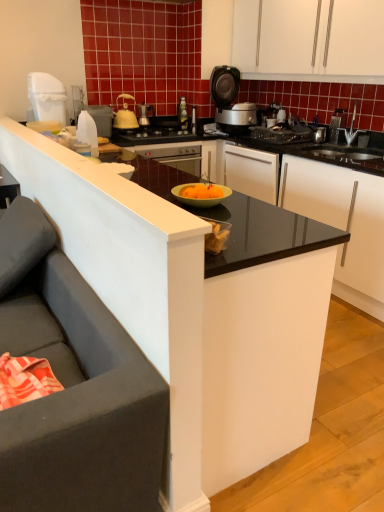
Image resolution: width=384 pixels, height=512 pixels. What do you see at coordinates (87, 132) in the screenshot?
I see `white plastic bottle at left, the first kitchen appliance from the front` at bounding box center [87, 132].

Describe the element at coordinates (47, 97) in the screenshot. The height and width of the screenshot is (512, 384). I see `white plastic trash can at upper left, acting as the 2th kitchen appliance starting from the front` at that location.

Find the location of a particular element. The image size is (384, 512). yellow matte kettle at upper center, the 3th kitchen appliance when ordered from left to right is located at coordinates (125, 114).

This screenshot has width=384, height=512. Describe the element at coordinates (310, 40) in the screenshot. I see `white matte cabinet at upper center` at that location.

The width and height of the screenshot is (384, 512). What do you see at coordinates (189, 315) in the screenshot?
I see `black glossy countertop at center` at bounding box center [189, 315].

Where is `black glossy countertop at center`? black glossy countertop at center is located at coordinates (189, 315).

Find the location of a particular element. Image resolution: width=384 pixels, height=512 pixels. white plastic bottle at left, which is the fourth kitchen appliance from back to front is located at coordinates (87, 132).

In the image, is metallic silver coffee maker at upper center, which is the 4th kitchen appliance in front-to-back order, positioned in front of or behind white plastic bottle at left, which is the fourth kitchen appliance from back to front?

Clearly, metallic silver coffee maker at upper center, which is the 4th kitchen appliance in front-to-back order, is behind white plastic bottle at left, which is the fourth kitchen appliance from back to front.

How different are the orientations of metallic silver coffee maker at upper center, acting as the 4th kitchen appliance starting from the left, and white plastic bottle at left, arranged as the 2th kitchen appliance when viewed from the left, in degrees?

The angle between the facing direction of metallic silver coffee maker at upper center, acting as the 4th kitchen appliance starting from the left, and the facing direction of white plastic bottle at left, arranged as the 2th kitchen appliance when viewed from the left, is 87.8 degrees.

Is metallic silver coffee maker at upper center, marked as the 1th kitchen appliance in a back-to-front arrangement, turned away from white plastic bottle at left, the first kitchen appliance from the front?

No, metallic silver coffee maker at upper center, marked as the 1th kitchen appliance in a back-to-front arrangement,'s orientation is not away from white plastic bottle at left, the first kitchen appliance from the front.

From the image's perspective, is metallic silver coffee maker at upper center, marked as the 1th kitchen appliance in a right-to-left arrangement, located above or below white plastic bottle at left, the first kitchen appliance from the front?

From the image's perspective, metallic silver coffee maker at upper center, marked as the 1th kitchen appliance in a right-to-left arrangement, appears above white plastic bottle at left, the first kitchen appliance from the front.

Is white plastic bottle at left, marked as the 3th kitchen appliance in a right-to-left arrangement, positioned behind yellow matte kettle at upper center, the 3th kitchen appliance when ordered from left to right?

No, white plastic bottle at left, marked as the 3th kitchen appliance in a right-to-left arrangement, is closer to the viewer.

Is white plastic bottle at left, which is the fourth kitchen appliance from back to front, to the left of yellow matte kettle at upper center, the 3th kitchen appliance when ordered from left to right, from the viewer's perspective?

Correct, you'll find white plastic bottle at left, which is the fourth kitchen appliance from back to front, to the left of yellow matte kettle at upper center, the 3th kitchen appliance when ordered from left to right.

Between white plastic bottle at left, which is the fourth kitchen appliance from back to front, and yellow matte kettle at upper center, the 3th kitchen appliance when ordered from left to right, which one has less height?

With less height is yellow matte kettle at upper center, the 3th kitchen appliance when ordered from left to right.

Is white plastic bottle at left, which is the fourth kitchen appliance from back to front, next to yellow matte kettle at upper center, which ranks as the 2th kitchen appliance in right-to-left order?

There is a gap between white plastic bottle at left, which is the fourth kitchen appliance from back to front, and yellow matte kettle at upper center, which ranks as the 2th kitchen appliance in right-to-left order.

Who is taller, black glossy countertop at center or yellow matte gas stove at center?

With more height is black glossy countertop at center.

Looking at the image, does black glossy countertop at center seem bigger or smaller compared to yellow matte gas stove at center?

Clearly, black glossy countertop at center is larger in size than yellow matte gas stove at center.

How far apart are black glossy countertop at center and yellow matte gas stove at center?

5.62 feet.

From the picture: Is black glossy countertop at center thinner than yellow matte gas stove at center?

In fact, black glossy countertop at center might be wider than yellow matte gas stove at center.

Is yellow matte gas stove at center inside white matte cabinet at upper center?

Actually, yellow matte gas stove at center is outside white matte cabinet at upper center.

Is point (288, 36) positioned after point (185, 134)?

No.

Who is taller, white matte cabinet at upper center or yellow matte gas stove at center?

white matte cabinet at upper center.

Considering the points (140, 110) and (224, 108), which point is in front, point (140, 110) or point (224, 108)?

The point (140, 110) is in front.

Does metallic silver coffee maker at upper center, marked as the 1th kitchen appliance in a back-to-front arrangement, have a lesser width compared to matte black rice cooker at upper center?

Yes, metallic silver coffee maker at upper center, marked as the 1th kitchen appliance in a back-to-front arrangement, is thinner than matte black rice cooker at upper center.

Looking at the image, does metallic silver coffee maker at upper center, which is the 4th kitchen appliance in front-to-back order, seem bigger or smaller compared to matte black rice cooker at upper center?

metallic silver coffee maker at upper center, which is the 4th kitchen appliance in front-to-back order, is smaller than matte black rice cooker at upper center.

Looking at this image, can you confirm if white plastic bottle at left, the first kitchen appliance from the front, is shorter than white matte cabinet at upper center?

Correct, white plastic bottle at left, the first kitchen appliance from the front, is not as tall as white matte cabinet at upper center.

Which kitchen appliance is the 3rd one when counting from the left side of the white matte cabinet at upper center? Please provide its 2D coordinates.

[(87, 132)]

From the image's perspective, between white plastic bottle at left, marked as the 3th kitchen appliance in a right-to-left arrangement, and white matte cabinet at upper center, which one is located above?

white matte cabinet at upper center.

In the image, is white plastic bottle at left, arranged as the 2th kitchen appliance when viewed from the left, positioned in front of or behind white matte cabinet at upper center?

white plastic bottle at left, arranged as the 2th kitchen appliance when viewed from the left, is behind white matte cabinet at upper center.

Is black glossy countertop at center to the left of dark gray fabric studio couch at left from the viewer's perspective?

No.

Does black glossy countertop at center have a lesser width compared to dark gray fabric studio couch at left?

Incorrect, the width of black glossy countertop at center is not less than that of dark gray fabric studio couch at left.

Which is closer to the camera, (85, 251) or (114, 463)?

Point (114, 463)

Considering the relative sizes of black glossy countertop at center and dark gray fabric studio couch at left in the image provided, is black glossy countertop at center shorter than dark gray fabric studio couch at left?

No, black glossy countertop at center is not shorter than dark gray fabric studio couch at left.

From the white plastic bottle at left, arranged as the 2th kitchen appliance when viewed from the left, count 3rd kitchen appliances backward and point to it. Please provide its 2D coordinates.

[(144, 114)]

Find the location of a particular element. The image size is (384, 512). kitchen appliance that is the 2nd object directly below the yellow matte kettle at upper center, the 2th kitchen appliance positioned from the back (from a real-world perspective) is located at coordinates (87, 132).

Looking at the image, which one is located further to white matte cabinet at upper center, white plastic bottle at left, arranged as the 2th kitchen appliance when viewed from the left, or metallic silver coffee maker at upper center, which is the 4th kitchen appliance in front-to-back order?

The object further to white matte cabinet at upper center is white plastic bottle at left, arranged as the 2th kitchen appliance when viewed from the left.

In the scene shown: From the image, which object appears to be nearer to white plastic bottle at left, arranged as the 2th kitchen appliance when viewed from the left, dark gray fabric studio couch at left or yellow matte kettle at upper center, the 2th kitchen appliance positioned from the back?

yellow matte kettle at upper center, the 2th kitchen appliance positioned from the back.

When comparing their distances from black glossy countertop at center, does yellow matte gas stove at center or white plastic trash can at upper left, which ranks as the fourth kitchen appliance in right-to-left order, seem closer?

white plastic trash can at upper left, which ranks as the fourth kitchen appliance in right-to-left order, lies closer to black glossy countertop at center than the other object.

Which object lies nearer to the anchor point metallic silver coffee maker at upper center, marked as the 1th kitchen appliance in a back-to-front arrangement, white plastic bottle at left, which is the fourth kitchen appliance from back to front, or dark gray fabric studio couch at left?

white plastic bottle at left, which is the fourth kitchen appliance from back to front, lies closer to metallic silver coffee maker at upper center, marked as the 1th kitchen appliance in a back-to-front arrangement, than the other object.

Which object lies nearer to the anchor point yellow matte gas stove at center, metallic silver coffee maker at upper center, marked as the 1th kitchen appliance in a right-to-left arrangement, or white plastic bottle at left, marked as the 3th kitchen appliance in a right-to-left arrangement?

metallic silver coffee maker at upper center, marked as the 1th kitchen appliance in a right-to-left arrangement, is closer to yellow matte gas stove at center.

Estimate the real-world distances between objects in this image. Which object is closer to white matte cabinet at upper center, matte black rice cooker at upper center or white plastic trash can at upper left, the first kitchen appliance from the left?

matte black rice cooker at upper center is positioned closer to the anchor white matte cabinet at upper center.

From the image, which object appears to be farther from metallic silver coffee maker at upper center, marked as the 1th kitchen appliance in a right-to-left arrangement, black glossy countertop at center or yellow matte kettle at upper center, which ranks as the 2th kitchen appliance in right-to-left order?

Based on the image, black glossy countertop at center appears to be further to metallic silver coffee maker at upper center, marked as the 1th kitchen appliance in a right-to-left arrangement.

Estimate the real-world distances between objects in this image. Which object is closer to dark gray fabric studio couch at left, black glossy countertop at center or yellow matte kettle at upper center, the 2th kitchen appliance positioned from the back?

Among the two, black glossy countertop at center is located nearer to dark gray fabric studio couch at left.

This screenshot has height=512, width=384. I want to click on cabinetry between black glossy countertop at center and metallic silver coffee maker at upper center, marked as the 1th kitchen appliance in a back-to-front arrangement, in the front-back direction, so click(310, 40).

Image resolution: width=384 pixels, height=512 pixels. In order to click on gas stove between yellow matte kettle at upper center, the 3th kitchen appliance when ordered from left to right, and matte black rice cooker at upper center from left to right in this screenshot , I will do `click(155, 133)`.

Identify the location of gas stove positioned between white plastic bottle at left, the first kitchen appliance from the front, and yellow matte kettle at upper center, the 3th kitchen appliance when ordered from left to right, from near to far. The width and height of the screenshot is (384, 512). (155, 133).

This screenshot has height=512, width=384. Find the location of `cabinetry between dark gray fabric studio couch at left and matte black rice cooker at upper center from front to back`. cabinetry between dark gray fabric studio couch at left and matte black rice cooker at upper center from front to back is located at coordinates (310, 40).